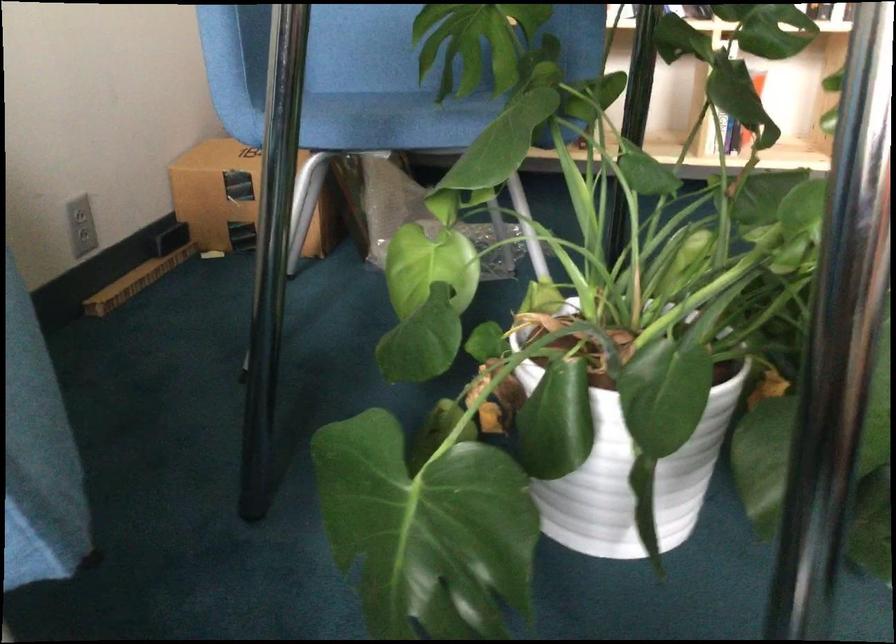
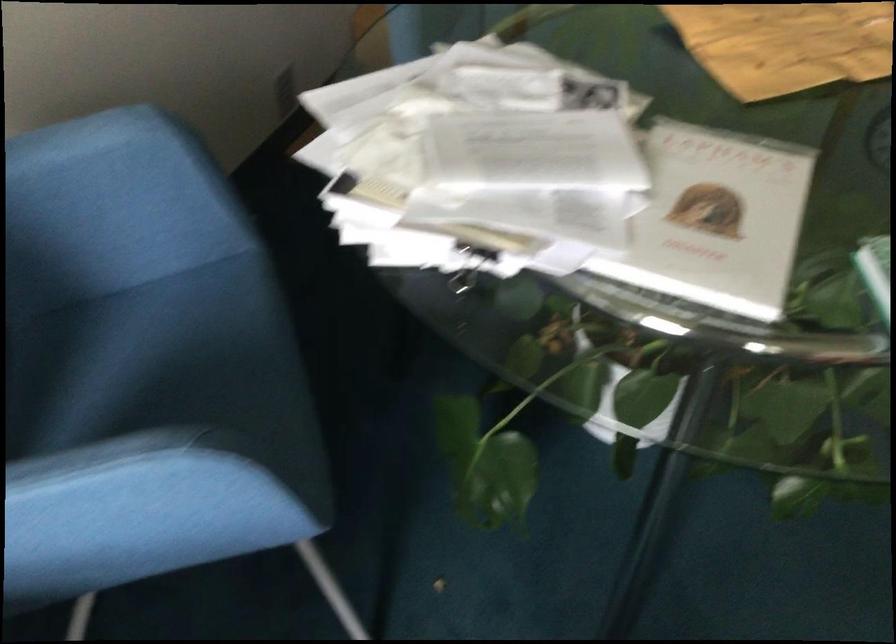
Where in the second image is the point corresponding to the point at 342,395 from the first image?

(469, 269)